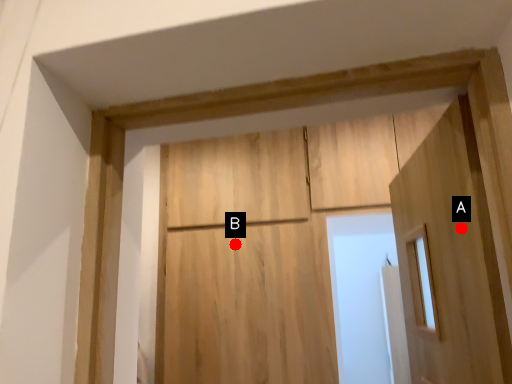
Question: Two points are circled on the image, labeled by A and B beside each circle. Which point is closer to the camera?

Choices:
 (A) A is closer
 (B) B is closer

Answer: (A)